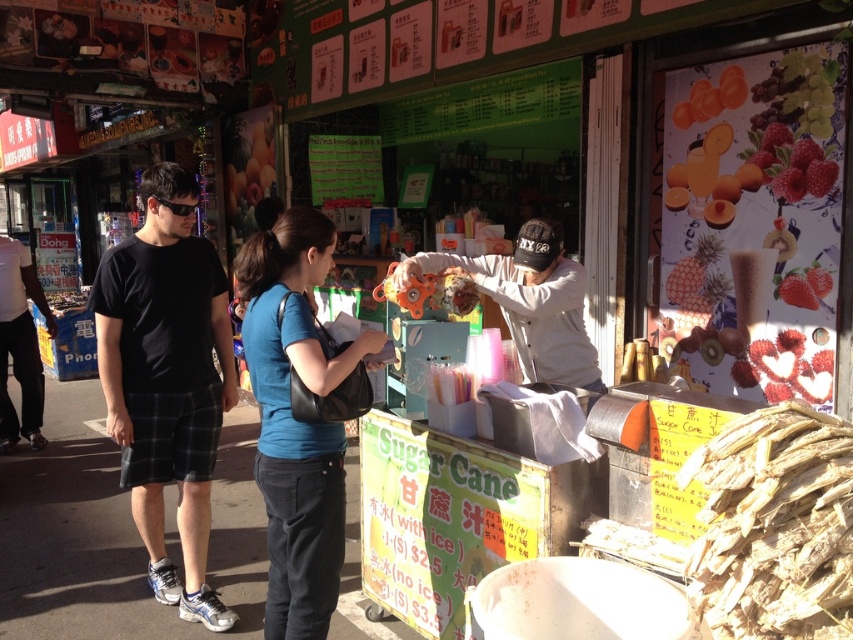
Is brown rough sugar cane at lower right to the left of white matte street vendor at center from the viewer's perspective?

In fact, brown rough sugar cane at lower right is to the right of white matte street vendor at center.

From the picture: Who is more distant from viewer, (786, 636) or (537, 376)?

The point (537, 376) is more distant.

Locate an element on the screen. The height and width of the screenshot is (640, 853). brown rough sugar cane at lower right is located at coordinates (773, 524).

Does black plaid shorts at left have a greater width compared to white matte street vendor at center?

No, black plaid shorts at left is not wider than white matte street vendor at center.

Who is more forward, (231, 611) or (561, 234)?

Point (561, 234) is in front.

Which is behind, point (123, 300) or point (490, 257)?

The point (490, 257) is more distant.

Identify the location of black plaid shorts at left. This screenshot has height=640, width=853. (167, 380).

Does black plaid shorts at left appear on the left side of brown rough sugar cane at lower right?

Yes, black plaid shorts at left is to the left of brown rough sugar cane at lower right.

Does black plaid shorts at left have a lesser width compared to brown rough sugar cane at lower right?

Incorrect, black plaid shorts at left's width is not less than brown rough sugar cane at lower right's.

Is point (103, 308) behind point (772, 637)?

Yes, it is behind point (772, 637).

Where is `black plaid shorts at left`? black plaid shorts at left is located at coordinates (167, 380).